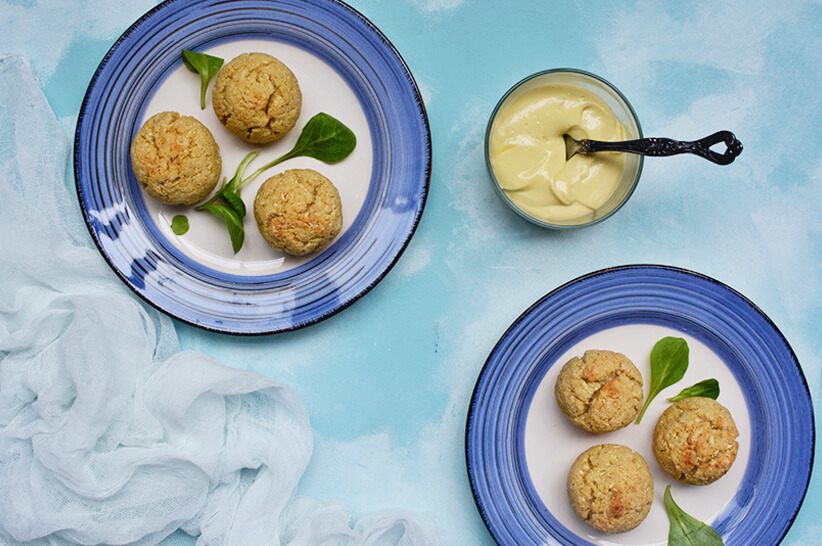
Find the location of a particular element. white of the plate is located at coordinates (326, 97), (561, 436).